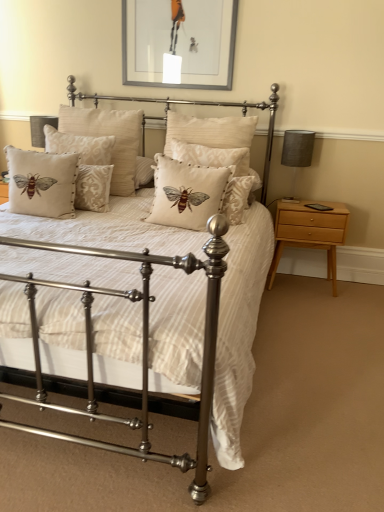
Question: Does point (301, 135) appear closer or farther from the camera than point (339, 204)?

Choices:
 (A) closer
 (B) farther

Answer: (A)

Question: In terms of height, does gray fabric lampshade at right look taller or shorter compared to light wood/finish nightstand at right?

Choices:
 (A) tall
 (B) short

Answer: (B)

Question: Which object is the closest to the beige fabric cushion with bee design at center, the 3th pillow when ordered from left to right?

Choices:
 (A) beige fabric cushion with embroidered bee at center, the second pillow in the right-to-left sequence
 (B) light wood/finish nightstand at right
 (C) beige fabric cushion with embroidered bee at left, positioned as the 1th pillow in left-to-right order
 (D) matte gray picture frame at upper center
 (E) gray fabric lampshade at right

Answer: (C)

Question: Which of these objects is positioned farthest from the beige fabric cushion with embroidered bee at center, positioned as the fifth pillow in left-to-right order?

Choices:
 (A) beige fabric cushion with embroidered bee at left, which ranks as the fifth pillow in right-to-left order
 (B) beige fabric cushion with bee design at center, the 3th pillow when ordered from left to right
 (C) matte gray picture frame at upper center
 (D) beige fabric cushion with embroidered bee at center, the second pillow in the right-to-left sequence
 (E) matte silver bed at center

Answer: (E)